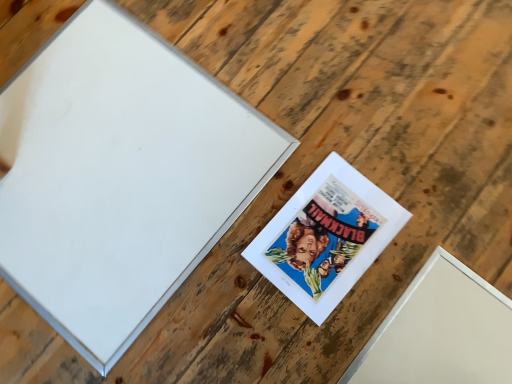
Locate an element on the screen. This screenshot has height=384, width=512. free space above white matte picture frame at upper left, which is counted as the first picture frame, starting from the left (from a real-world perspective) is located at coordinates (111, 167).